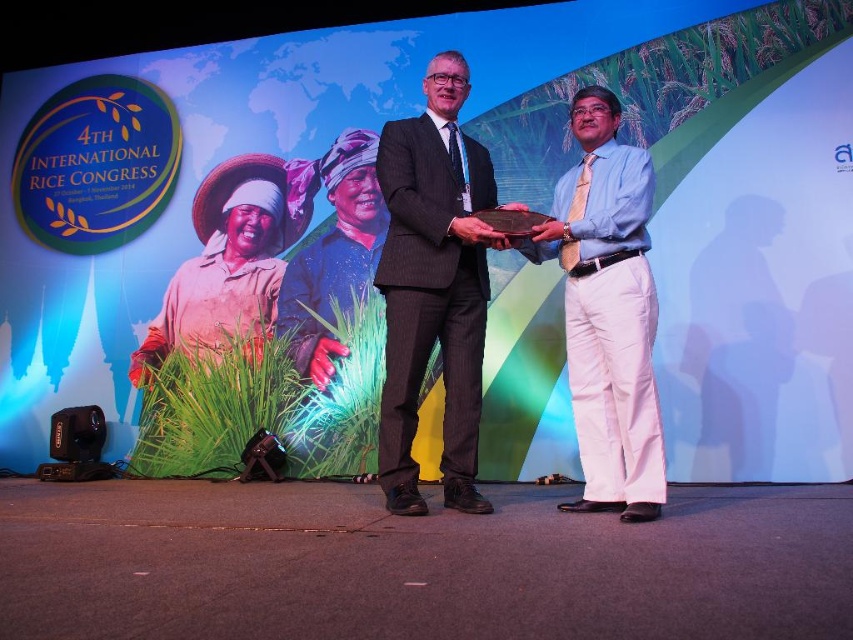
Question: Is matte black suit at center positioned behind light blue shirt at center?

Choices:
 (A) no
 (B) yes

Answer: (B)

Question: In this image, where is matte black suit at center located relative to light blue shirt at center?

Choices:
 (A) below
 (B) above

Answer: (B)

Question: Which of the following is the closest to the observer?

Choices:
 (A) matte black suit at center
 (B) light blue shirt at center

Answer: (B)

Question: Is matte black suit at center above light blue shirt at center?

Choices:
 (A) no
 (B) yes

Answer: (B)

Question: Among these points, which one is farthest from the camera?

Choices:
 (A) (404, 120)
 (B) (651, 380)

Answer: (A)

Question: Among these objects, which one is nearest to the camera?

Choices:
 (A) matte black suit at center
 (B) light blue shirt at center

Answer: (B)